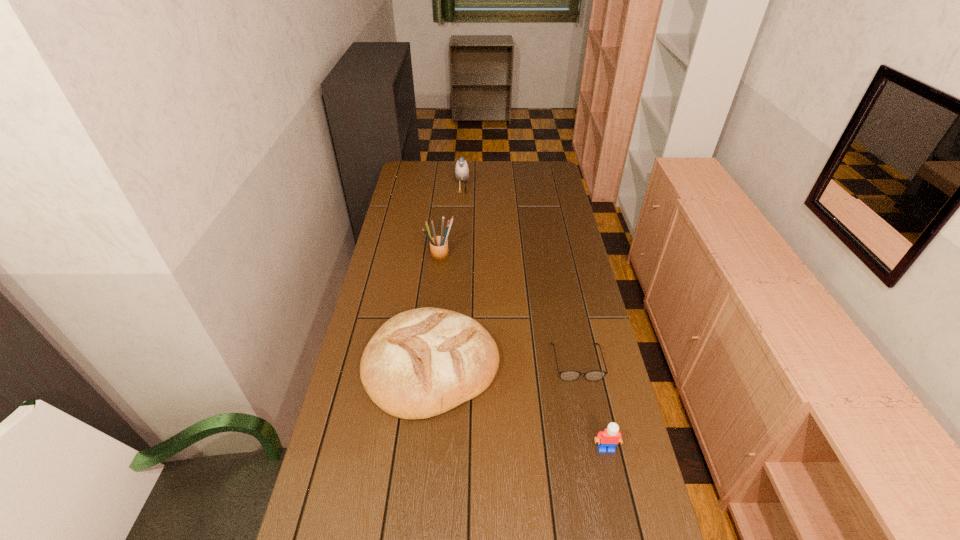
Where is `object at the far edge`? object at the far edge is located at coordinates (461, 168).

The height and width of the screenshot is (540, 960). In order to click on object at the left edge in this screenshot , I will do `click(423, 362)`.

This screenshot has height=540, width=960. I want to click on Lego that is at the right edge, so click(x=609, y=438).

This screenshot has width=960, height=540. What are the coordinates of `spectacles located in the right edge section of the desktop` in the screenshot? It's located at (570, 375).

The height and width of the screenshot is (540, 960). Identify the location of blank space at the far edge of the desktop. (449, 181).

Locate an element on the screen. The height and width of the screenshot is (540, 960). free space at the left edge is located at coordinates (415, 198).

In the image, there is a desktop. Identify the location of free region at the right edge. (538, 201).

The image size is (960, 540). Find the location of `unoccupied area between the pencil box and the shortest object`. unoccupied area between the pencil box and the shortest object is located at coordinates (509, 309).

Identify the location of free spot between the bird and the Lego. (534, 319).

I want to click on free space between the bird and the nearest object, so click(x=534, y=319).